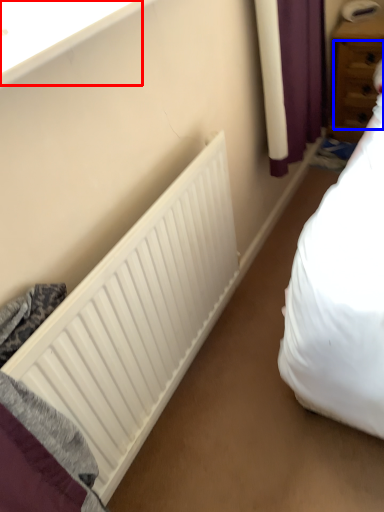
Question: Which point is further to the camera, window sill (highlighted by a red box) or drawer (highlighted by a blue box)?

Choices:
 (A) window sill
 (B) drawer

Answer: (B)